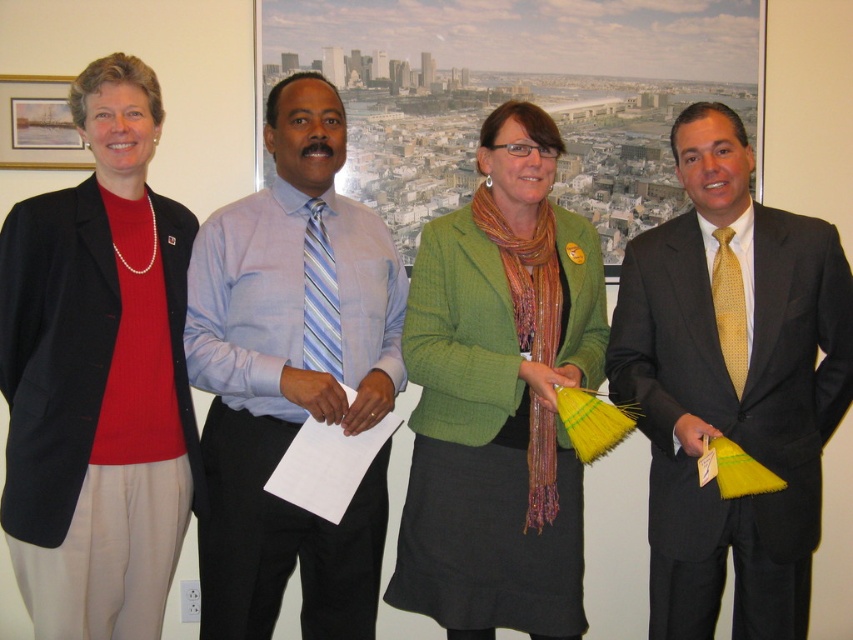
Does yellow dotted tie at center appear on the right side of blue striped tie at center?

Correct, you'll find yellow dotted tie at center to the right of blue striped tie at center.

Is yellow dotted tie at center positioned before blue striped tie at center?

That is True.

Is point (741, 596) more distant than point (210, 289)?

No.

Locate an element on the screen. yellow dotted tie at center is located at coordinates (730, 385).

Which is more to the left, matte black blazer at left or wooden frame at upper left?

wooden frame at upper left is more to the left.

Is matte black blazer at left below wooden frame at upper left?

Yes, matte black blazer at left is below wooden frame at upper left.

Is point (24, 273) positioned after point (28, 116)?

That is False.

The height and width of the screenshot is (640, 853). I want to click on matte black blazer at left, so click(97, 376).

Which is above, matte black blazer at left or yellow dotted tie at center?

matte black blazer at left is higher up.

Is matte black blazer at left wider than yellow dotted tie at center?

In fact, matte black blazer at left might be narrower than yellow dotted tie at center.

Where is `matte black blazer at left`? Image resolution: width=853 pixels, height=640 pixels. matte black blazer at left is located at coordinates (97, 376).